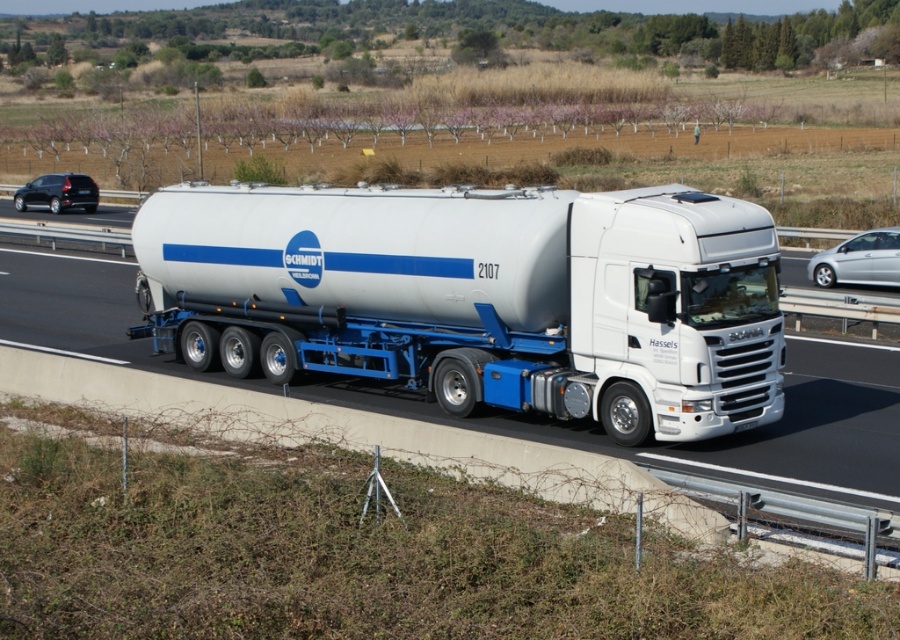
Does white glossy tanker at center appear on the left side of silver metallic sedan at right?

Indeed, white glossy tanker at center is positioned on the left side of silver metallic sedan at right.

Between white glossy tanker at center and silver metallic sedan at right, which one has less height?

With less height is silver metallic sedan at right.

Which is behind, point (652, 392) or point (834, 262)?

The point (834, 262) is behind.

Identify the location of white glossy tanker at center. The image size is (900, 640). (480, 296).

Is white glossy tanker at center wider than black matte car at left?

Yes.

In the scene shown: Which is more to the right, white glossy tanker at center or black matte car at left?

white glossy tanker at center

Where is `white glossy tanker at center`? This screenshot has width=900, height=640. white glossy tanker at center is located at coordinates (480, 296).

Which is in front, point (878, 241) or point (92, 188)?

Point (878, 241) is in front.

The height and width of the screenshot is (640, 900). Identify the location of silver metallic sedan at right. (860, 260).

What do you see at coordinates (860, 260) in the screenshot? The height and width of the screenshot is (640, 900). I see `silver metallic sedan at right` at bounding box center [860, 260].

Where is `silver metallic sedan at right`? Image resolution: width=900 pixels, height=640 pixels. silver metallic sedan at right is located at coordinates (860, 260).